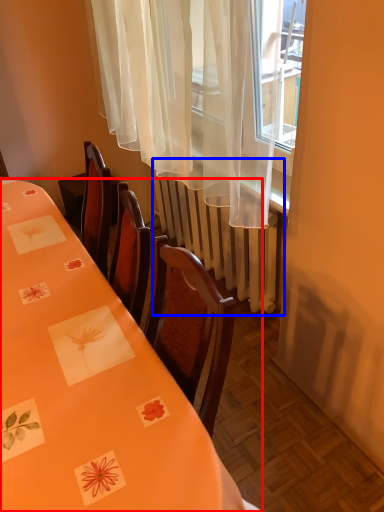
Question: Which of the following is the closest to the observer, table (highlighted by a red box) or radiator (highlighted by a blue box)?

Choices:
 (A) table
 (B) radiator

Answer: (A)